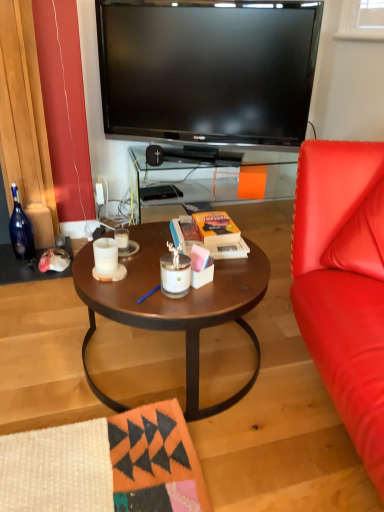
Question: Is white matte candle at center, placed as the second coffee cup when sorted from back to front, oriented towards matte brown coffee table at center?

Choices:
 (A) yes
 (B) no

Answer: (B)

Question: Is white matte candle at center, placed as the second coffee cup when sorted from back to front, thinner than matte brown coffee table at center?

Choices:
 (A) no
 (B) yes

Answer: (B)

Question: Is white matte candle at center, which appears as the first coffee cup when viewed from the front, not inside matte brown coffee table at center?

Choices:
 (A) no
 (B) yes

Answer: (B)

Question: Does white matte candle at center, placed as the second coffee cup when sorted from back to front, have a greater width compared to matte brown coffee table at center?

Choices:
 (A) yes
 (B) no

Answer: (B)

Question: Is white matte candle at center, which appears as the first coffee cup when viewed from the front, shorter than matte brown coffee table at center?

Choices:
 (A) no
 (B) yes

Answer: (B)

Question: Visually, is orange matte book at center positioned to the left or to the right of white matte candle at center, placed as the second coffee cup when sorted from back to front?

Choices:
 (A) right
 (B) left

Answer: (A)

Question: From the image's perspective, is orange matte book at center positioned above or below white matte candle at center, placed as the second coffee cup when sorted from back to front?

Choices:
 (A) below
 (B) above

Answer: (B)

Question: From a real-world perspective, is orange matte book at center positioned above or below white matte candle at center, which appears as the first coffee cup when viewed from the front?

Choices:
 (A) below
 (B) above

Answer: (A)

Question: Is orange matte book at center in front of or behind white matte candle at center, placed as the second coffee cup when sorted from back to front, in the image?

Choices:
 (A) behind
 (B) front

Answer: (A)

Question: Considering the positions of wooden table at center and matte brown coffee table at center in the image, is wooden table at center wider or thinner than matte brown coffee table at center?

Choices:
 (A) wide
 (B) thin

Answer: (B)

Question: Considering the relative positions of wooden table at center and matte brown coffee table at center in the image provided, is wooden table at center to the left or to the right of matte brown coffee table at center?

Choices:
 (A) right
 (B) left

Answer: (A)

Question: Relative to matte brown coffee table at center, is wooden table at center in front or behind?

Choices:
 (A) behind
 (B) front

Answer: (A)

Question: Is wooden table at center bigger or smaller than matte brown coffee table at center?

Choices:
 (A) small
 (B) big

Answer: (B)

Question: From a real-world perspective, relative to orange matte book at center, is black plastic speaker at center vertically above or below?

Choices:
 (A) above
 (B) below

Answer: (A)

Question: From the image's perspective, is black plastic speaker at center above or below orange matte book at center?

Choices:
 (A) above
 (B) below

Answer: (A)